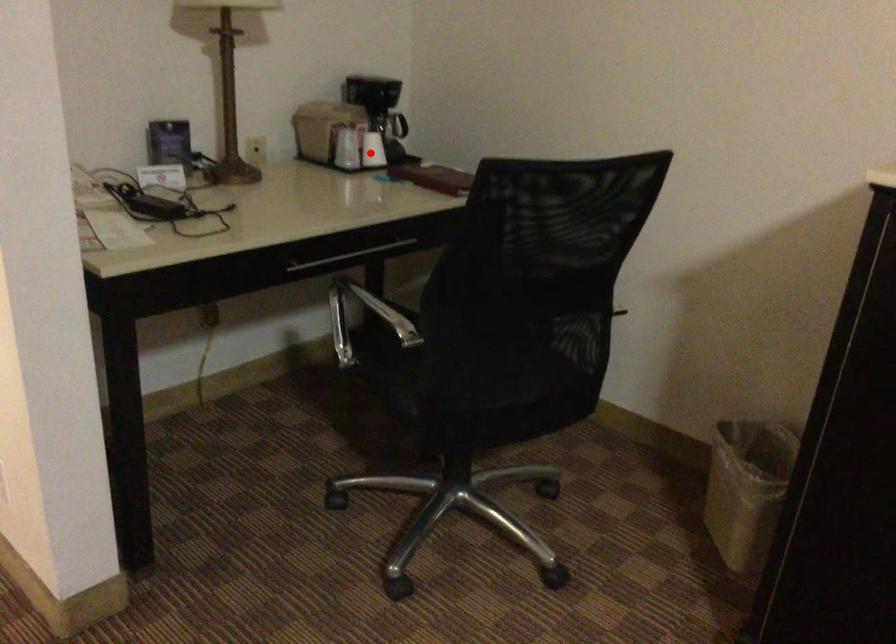
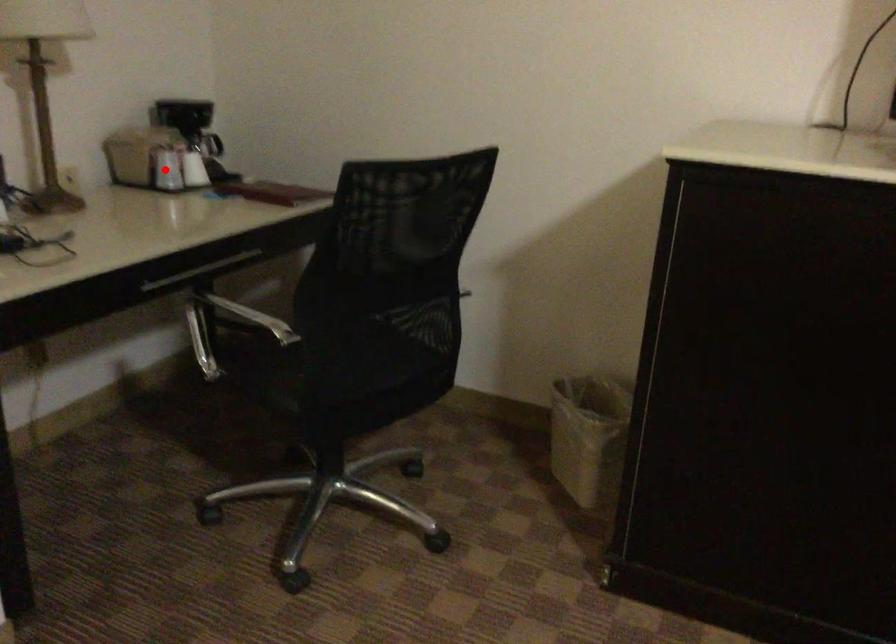
I am providing you with two images of the same scene from different viewpoints. A red point is marked on the first image and another point is marked on the second image. Is the red point in image1 aligned with the point shown in image2?

No